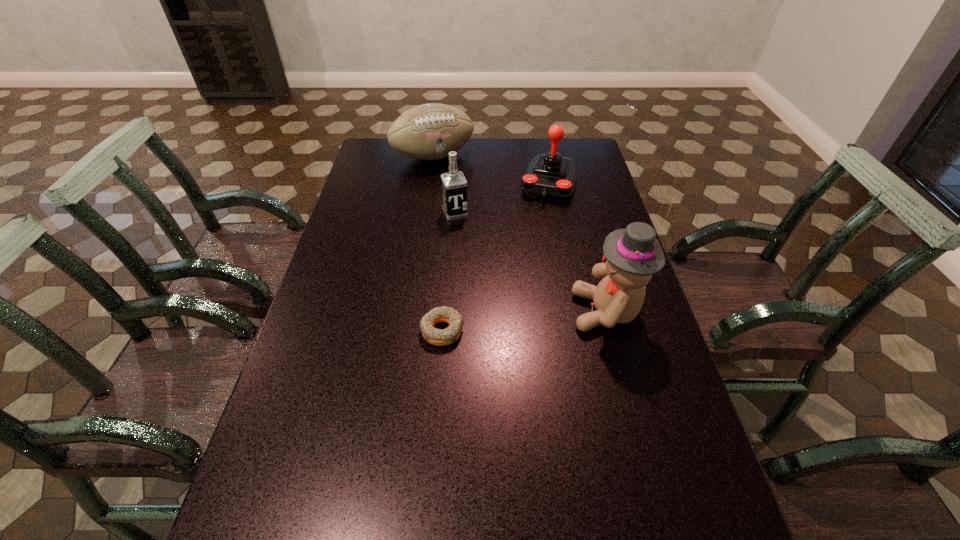
What are the coordinates of `doughnut` in the screenshot? It's located at (434, 336).

This screenshot has height=540, width=960. Find the location of `the tallest object`. the tallest object is located at coordinates click(x=632, y=255).

Where is `vodka`? Image resolution: width=960 pixels, height=540 pixels. vodka is located at coordinates (454, 184).

Image resolution: width=960 pixels, height=540 pixels. What are the coordinates of `joystick` in the screenshot? It's located at (549, 176).

Identify the location of football (American). The height and width of the screenshot is (540, 960). (427, 132).

Where is `free region located on the back of the doughnut`? The height and width of the screenshot is (540, 960). free region located on the back of the doughnut is located at coordinates (450, 228).

Image resolution: width=960 pixels, height=540 pixels. Find the location of `vacant space situated on the front-facing side of the tallest object`. vacant space situated on the front-facing side of the tallest object is located at coordinates (434, 312).

Where is `free space located on the front-facing side of the tallest object`? This screenshot has height=540, width=960. free space located on the front-facing side of the tallest object is located at coordinates (452, 312).

Find the location of a particular element. The height and width of the screenshot is (540, 960). vacant region located 0.240m on the front-facing side of the tallest object is located at coordinates (482, 312).

Locate an element on the screen. This screenshot has width=960, height=540. free location located on the front label of the vodka is located at coordinates (478, 264).